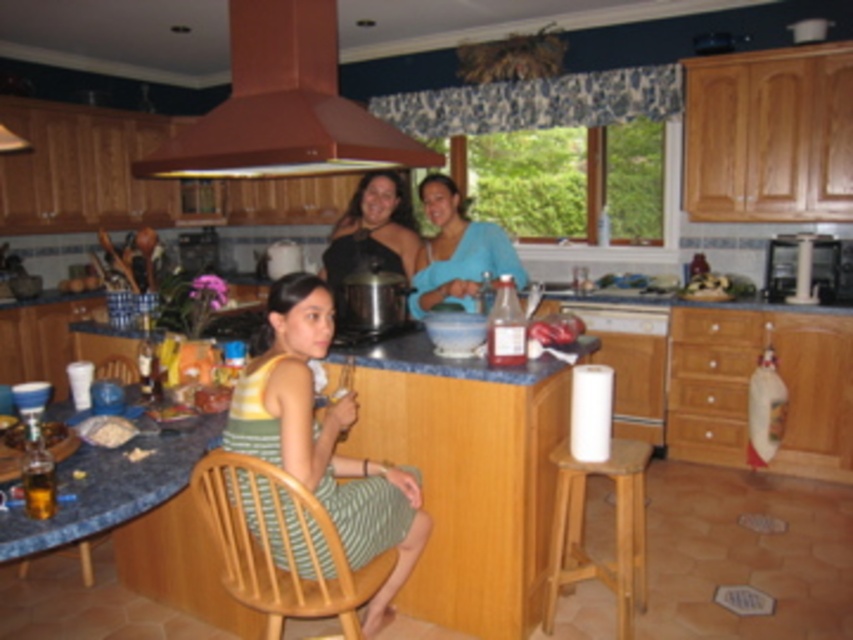
You are trying to decide whether to place a decorative bowl on the light brown wooden chair at center or the black satin blouse at center. Based on their positions, which one is more accessible to you?

The light brown wooden chair at center is closer to the viewer than the black satin blouse at center, so the light brown wooden chair at center is more accessible.

Based on the photo, you are a chef preparing to clean up the kitchen. You see the wooden stool at lower right and the white crumbly food at lower left. Which object is located closer to the floor?

The wooden stool at lower right is positioned under the white crumbly food at lower left, meaning the stool is closer to the floor than the food.

Consider the image. You are a chef who needs to clean up the white crumbly food at lower left before the brown matte exhaust hood at upper center gets dirty. Given that the distance between them is 1.19 meters, is there enough space to prevent crumbs from reaching the hood?

The brown matte exhaust hood at upper center is 1.19 meters away from the white crumbly food at lower left. Since the distance is sufficient, crumbs are unlikely to reach the hood unless thrown or blown intentionally.